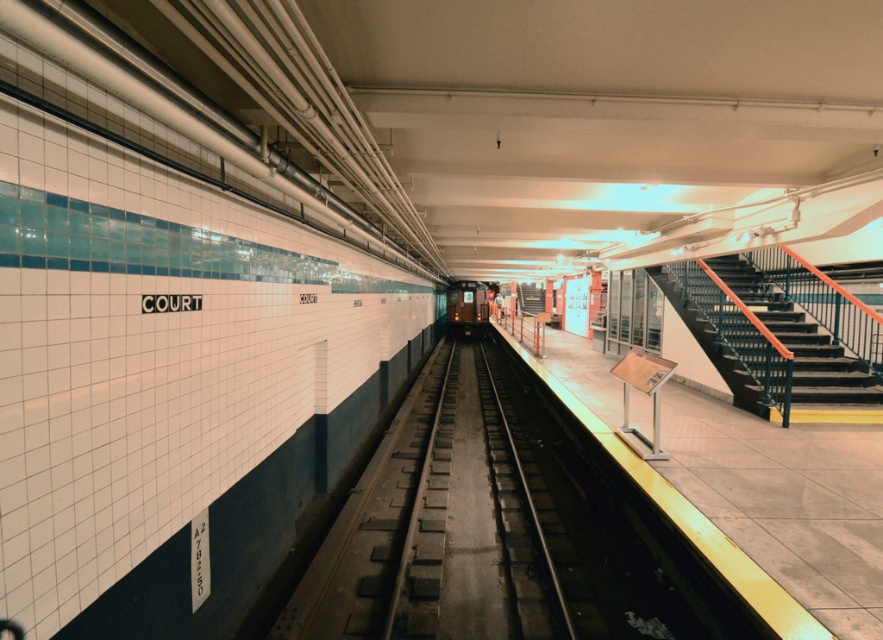
You are standing at the point marked by the coordinates [478,529] on the subway platform. What object are you standing on?

The point marked by the coordinates [478,529] marks the black metal train track at center, so you are standing on the black metal train track at center.